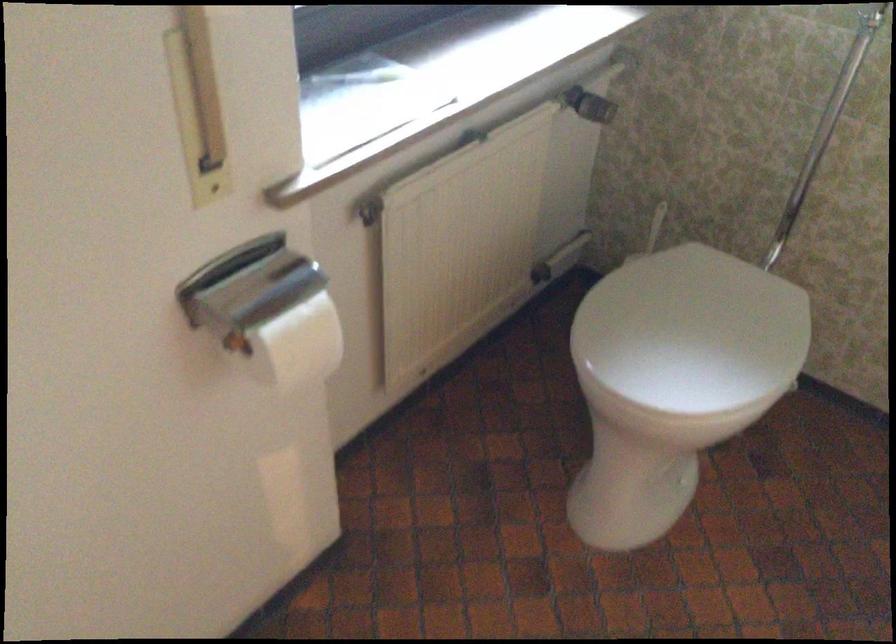
Describe the element at coordinates (197, 106) in the screenshot. This screenshot has width=896, height=644. I see `the wall switch` at that location.